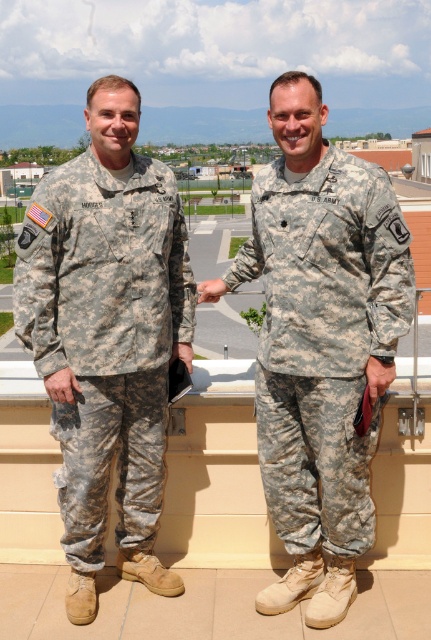
Question: Which point appears closest to the camera in this image?

Choices:
 (A) (316, 257)
 (B) (25, 300)

Answer: (A)

Question: Does camouflage fabric uniform at left come behind camouflage fabric uniform at center?

Choices:
 (A) yes
 (B) no

Answer: (A)

Question: Does camouflage fabric uniform at left appear on the right side of camouflage fabric uniform at center?

Choices:
 (A) no
 (B) yes

Answer: (A)

Question: Does camouflage fabric uniform at left have a larger size compared to camouflage fabric uniform at center?

Choices:
 (A) no
 (B) yes

Answer: (A)

Question: Which object appears farthest from the camera in this image?

Choices:
 (A) camouflage fabric uniform at left
 (B) camouflage fabric uniform at center

Answer: (A)